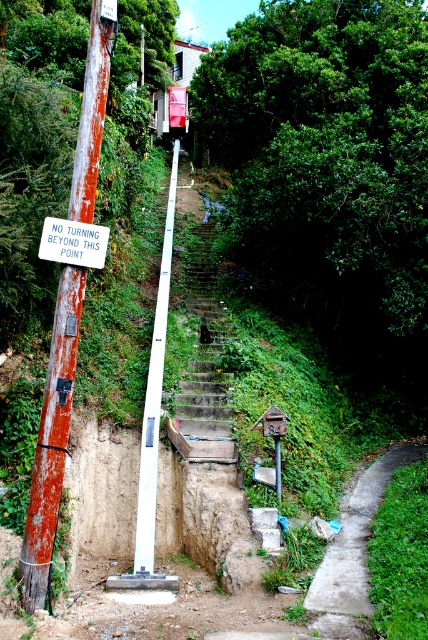
You are a delivery person with a cart that can only navigate paths wider than 1.2 meters. You see the rusty metal pole at left and the white plastic sign at upper left. Based on the scene, can your cart pass between them?

The rusty metal pole at left is bigger than the white plastic sign at upper left, but the scene description mentions the staircase is narrow and surrounded by vegetation. Without specific distance details between the pole and sign, it is uncertain if the path is wide enough for the cart.